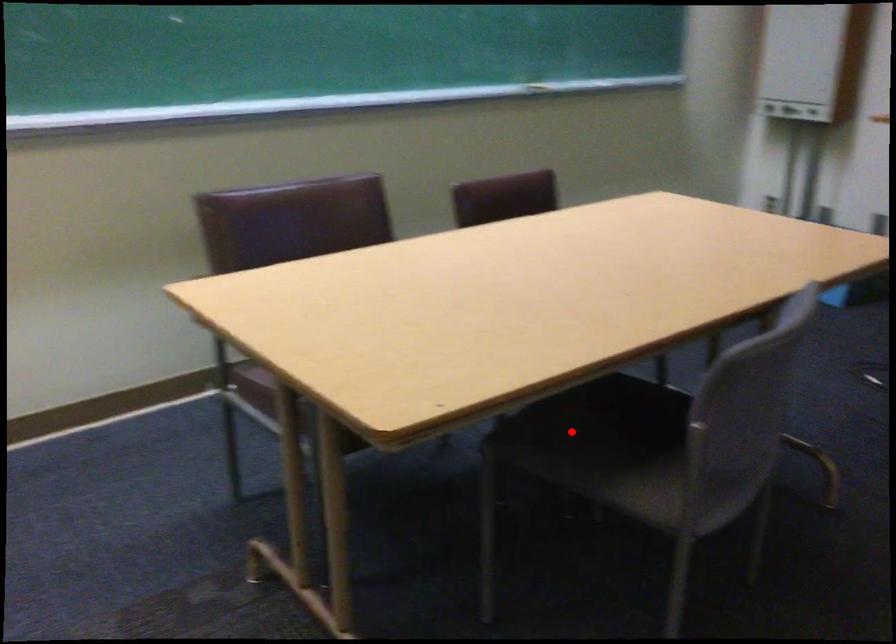
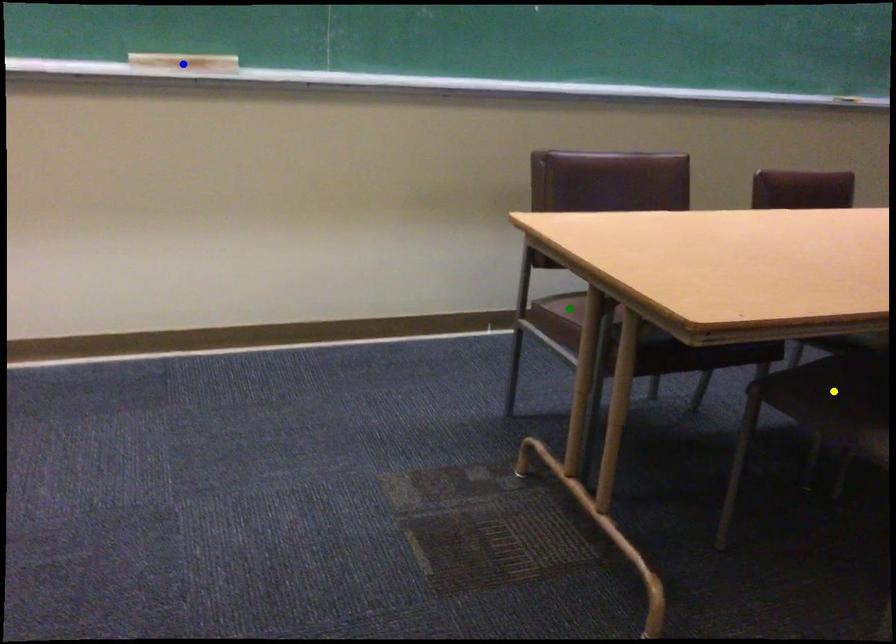
Question: I am providing you with two images of the same scene from different viewpoints. A red point is marked on the first image. You are given multiple points on the second image. Which spot in image 2 lines up with the point in image 1?

Choices:
 (A) yellow point
 (B) green point
 (C) blue point

Answer: (A)